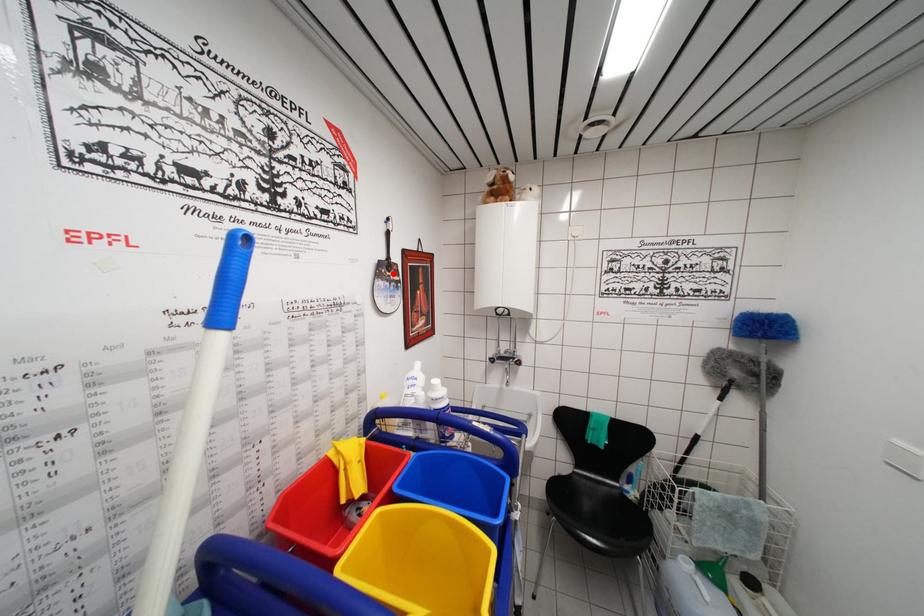
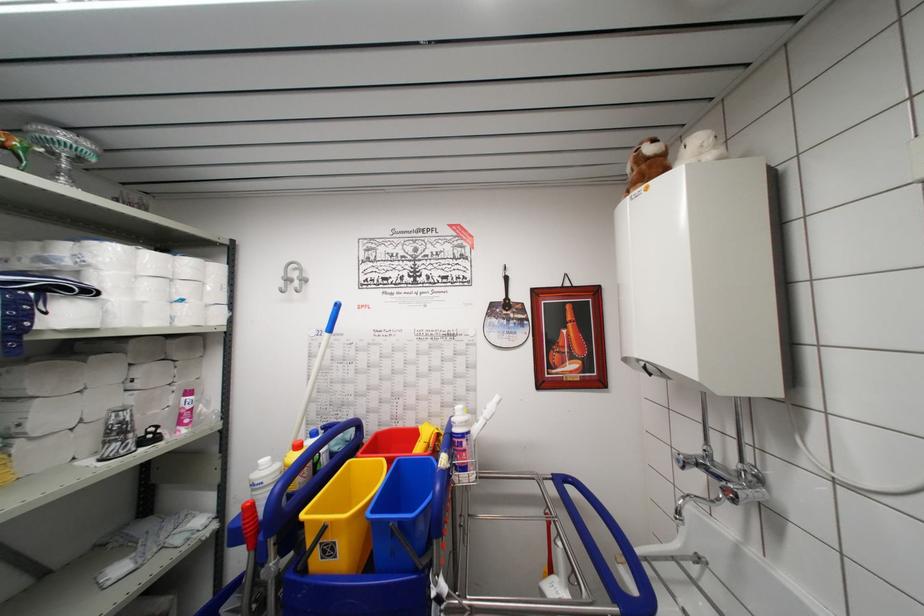
The point at the highlighted location is marked in the first image. Where is the corresponding point in the second image?

(511, 313)